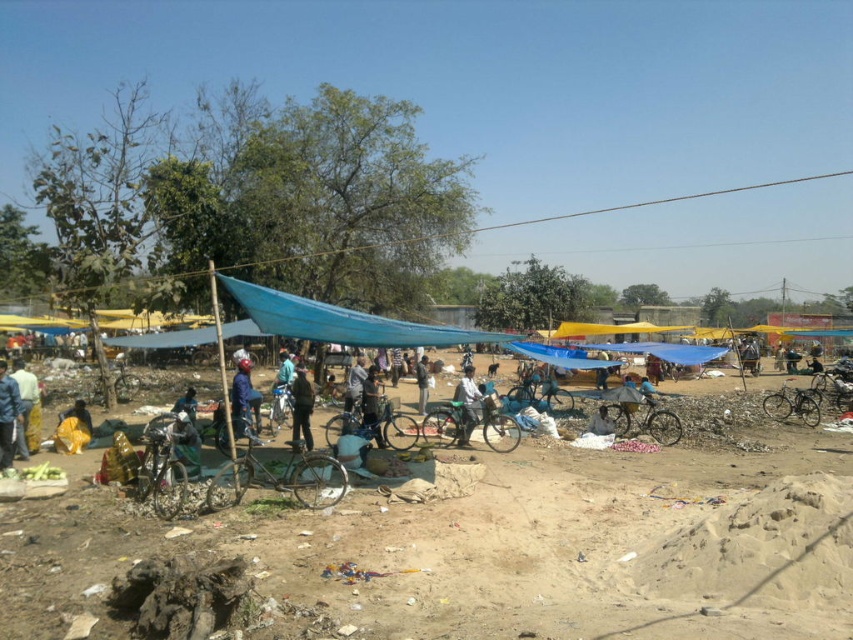
Measure the distance between blue fabric canopy at center and camera.

blue fabric canopy at center and camera are 10.63 meters apart from each other.

Is point (329, 312) less distant than point (473, 374)?

Yes, point (329, 312) is closer to viewer.

At what (x,y) coordinates should I click in order to perform the action: click on blue fabric canopy at center. Please return your answer as a coordinate pair (x, y). Looking at the image, I should click on (341, 321).

Between brown sandy dirt field at center and dark gray fabric at center, which one appears on the right side from the viewer's perspective?

brown sandy dirt field at center is more to the right.

Is brown sandy dirt field at center in front of dark gray fabric at center?

Yes.

Who is more distant from viewer, (401, 634) or (427, 368)?

The point (427, 368) is behind.

What are the coordinates of `brown sandy dirt field at center` in the screenshot? It's located at (473, 552).

This screenshot has width=853, height=640. Describe the element at coordinates (9, 416) in the screenshot. I see `blue fabric jacket at left` at that location.

In order to click on blue fabric jacket at left in this screenshot , I will do `click(9, 416)`.

Identify the location of blue fabric jacket at left. The width and height of the screenshot is (853, 640). (9, 416).